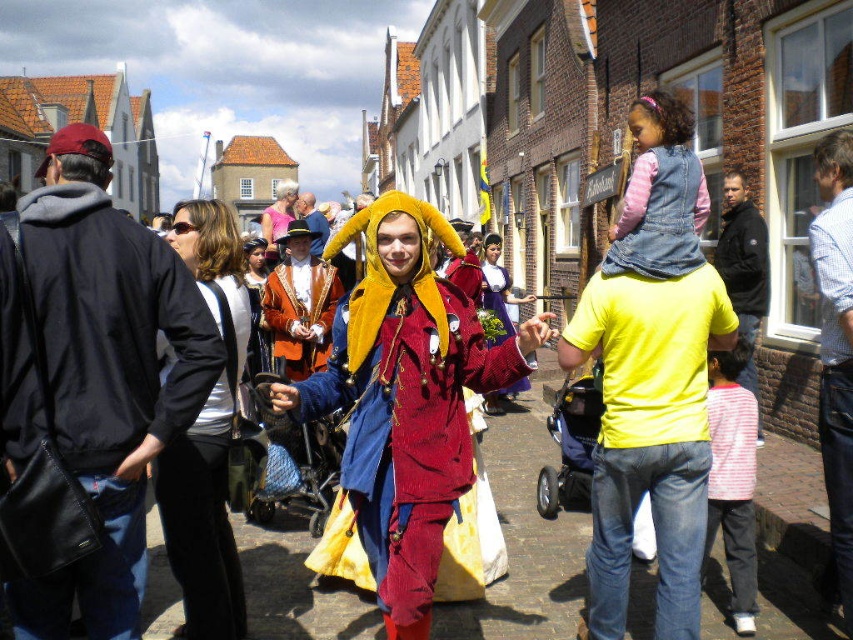
Can you confirm if leather jacket at center is positioned to the left of black jacket at right?

Yes, leather jacket at center is to the left of black jacket at right.

Is point (328, 344) farther from viewer compared to point (735, 180)?

Yes, it is.

The height and width of the screenshot is (640, 853). I want to click on leather jacket at center, so click(x=300, y=305).

Image resolution: width=853 pixels, height=640 pixels. What do you see at coordinates (300, 305) in the screenshot? I see `leather jacket at center` at bounding box center [300, 305].

Is leather jacket at center in front of velvet gold hat at center?

Yes, it is.

Between point (322, 317) and point (294, 204), which one is positioned in front?

Positioned in front is point (322, 317).

I want to click on leather jacket at center, so click(300, 305).

Which of these two, black leather jacket at center or matte pink dress at center, stands shorter?

Standing shorter between the two is black leather jacket at center.

Between point (177, 556) and point (277, 198), which one is positioned behind?

Point (277, 198)

Identify the location of black leather jacket at center. (207, 435).